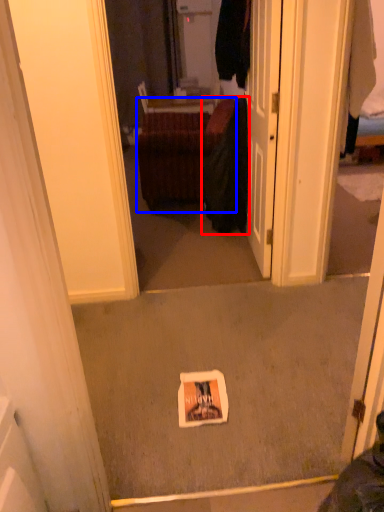
Question: Which object appears farthest to the camera in this image, clothing (highlighted by a red box) or furniture (highlighted by a blue box)?

Choices:
 (A) clothing
 (B) furniture

Answer: (B)